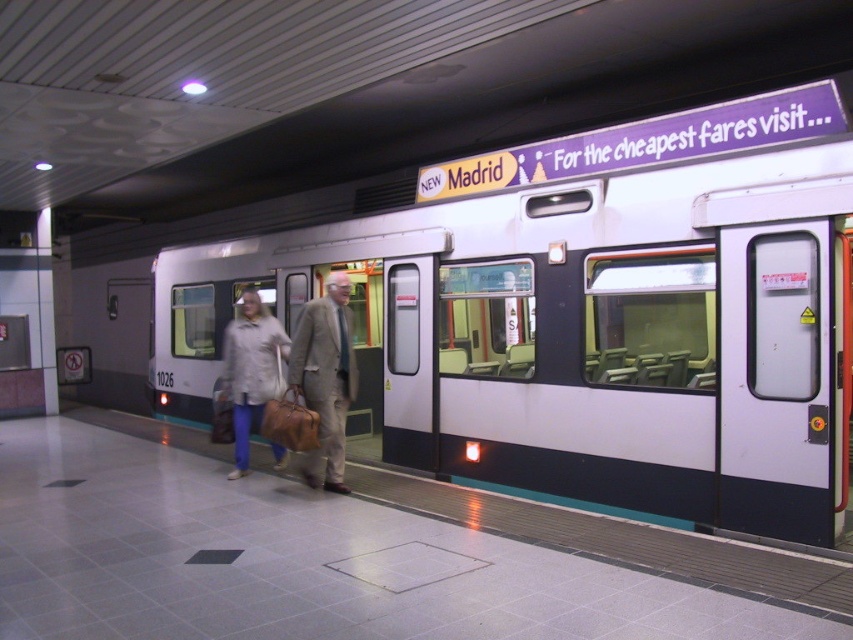
Consider the image. You are standing on the subway platform and want to board the train before it departs. You see the white glossy train at center and the light beige coat at center. Which object is closer to you, and why?

The white glossy train at center is closer to you because it is positioned further to the viewer than the light beige coat at center, meaning it appears nearer in your line of sight.

You are a fashion designer observing two items on a mannequin at a subway station platform. The items are the light beige fabric suit at center and the light beige coat at center. Which item has a more slender silhouette?

The light beige fabric suit at center is thinner than the light beige coat at center, so it has a more slender silhouette.